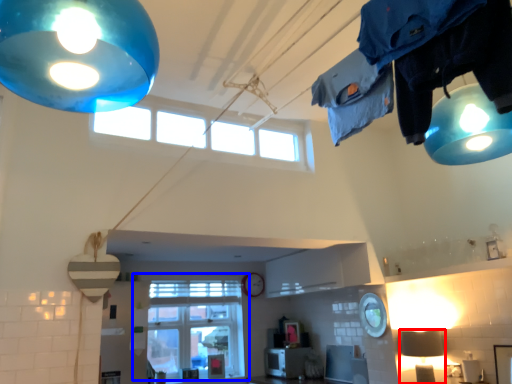
Question: Which of the following is the farthest to the observer, lamp (highlighted by a red box) or window (highlighted by a blue box)?

Choices:
 (A) lamp
 (B) window

Answer: (B)